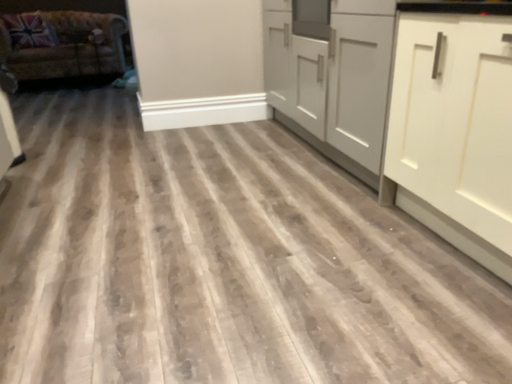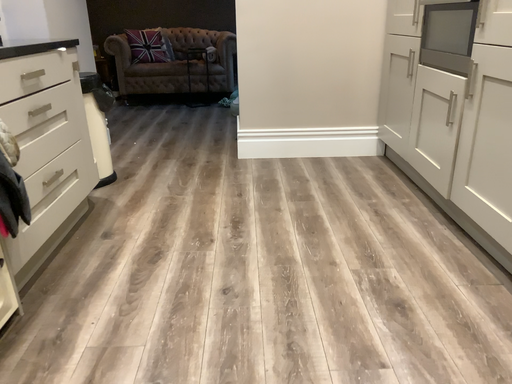
Question: Which way did the camera rotate in the video?

Choices:
 (A) rotated left
 (B) rotated right

Answer: (A)